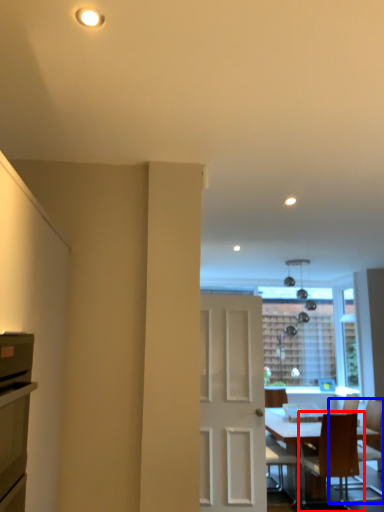
Question: Which point is further to the camera, chair (highlighted by a red box) or chair (highlighted by a blue box)?

Choices:
 (A) chair
 (B) chair

Answer: (B)